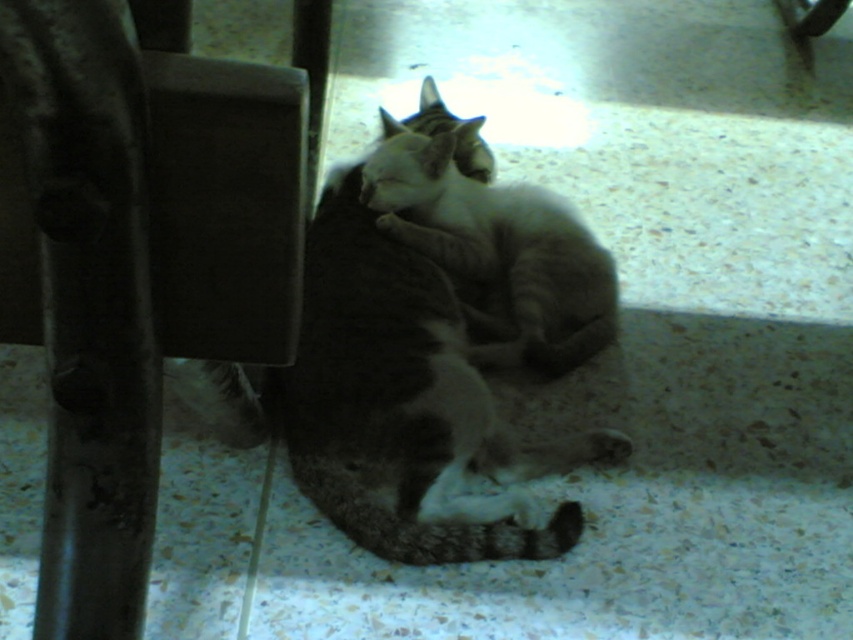
You are a cat owner who wants to place a 20 inch tall cat tree in the room. You see the metallic dark brown chair at left. Can you fit the cat tree between you and the chair?

The metallic dark brown chair at left is 19.93 inches away from viewer. Since the cat tree is 20 inches tall, it might not fit as the distance is slightly less than the tree height. Consider moving the chair closer or choosing a smaller tree.

You are a photographer trying to capture a closeup of the tabby fur cat at center. Since the tabby cat at center is blocking the view, can you move the camera to the left to get a clear shot?

The tabby fur cat at center is positioned under tabby cat at center, so moving the camera to the left might allow you to see the tabby fur cat at center from above or the side, but the tabby cat at center may still partially block the view depending on their exact positions.

Consider the image. You are trying to place a small decorative pillow that is 30 cm wide on the floor between the metallic dark brown chair at left and the tabby fur cat at center. Can the pillow fit in that space?

The metallic dark brown chair at left is smaller than the tabby fur cat at center. However, the exact distance between them isn not specified in the objects description. Therefore, it is uncertain if the pillow will fit.